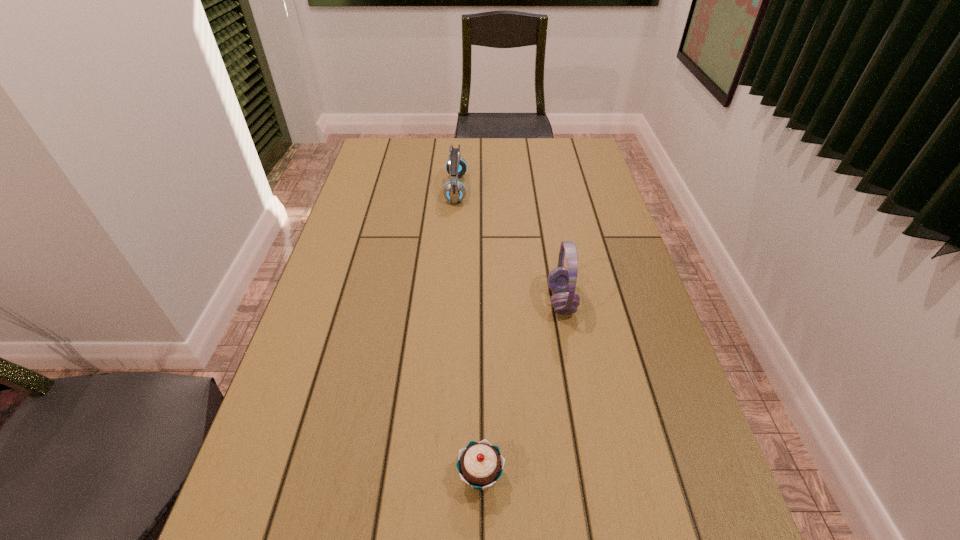
You are a GUI agent. You are given a task and a screenshot of the screen. Output one action in this format:
    pyautogui.click(x=<x>, y=<y>)
    Task: Click on the vacant region that satisfies the following two spatial constraints: 1. on the back side of the nearest object; 2. on the ear cups of the left headset
    The image size is (960, 540).
    Given the screenshot: What is the action you would take?
    pyautogui.click(x=480, y=189)

This screenshot has height=540, width=960. I want to click on free space in the image that satisfies the following two spatial constraints: 1. on the ear cups of the cupcake; 2. on the left side of the left headset, so click(436, 476).

At what (x,y) coordinates should I click in order to perform the action: click on free space that satisfies the following two spatial constraints: 1. on the ear cups of the cupcake; 2. on the right side of the farthest object. Please return your answer as a coordinate pair (x, y). Image resolution: width=960 pixels, height=540 pixels. Looking at the image, I should click on (436, 476).